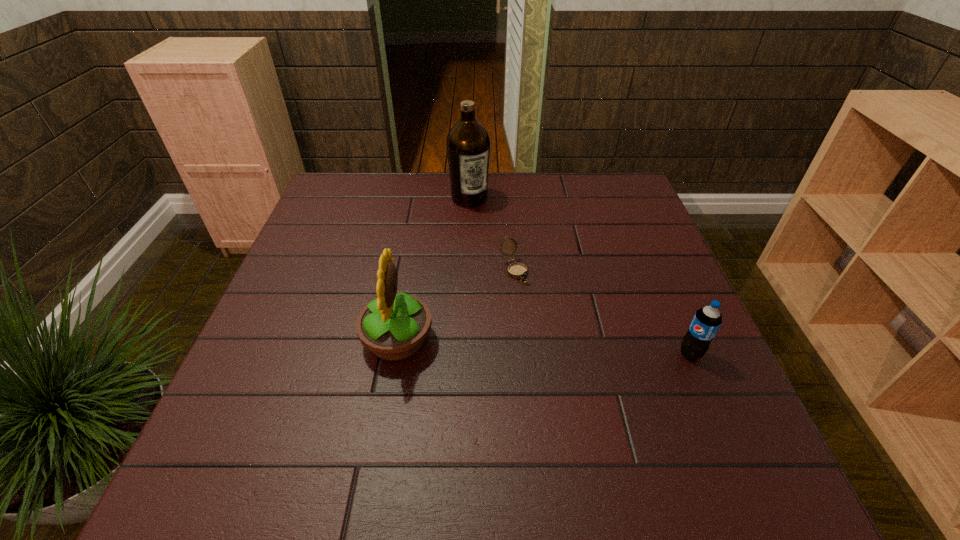
Identify the location of vacant space at the left edge of the desktop. (332, 285).

In the image, there is a desktop. Identify the location of vacant space at the right edge. The height and width of the screenshot is (540, 960). (635, 275).

In the image, there is a desktop. What are the coordinates of `vacant space at the far left corner` in the screenshot? It's located at tap(330, 179).

At what (x,y) coordinates should I click in order to perform the action: click on free point between the second tallest object and the farthest object. Please return your answer as a coordinate pair (x, y). Looking at the image, I should click on (433, 269).

The height and width of the screenshot is (540, 960). What are the coordinates of `vacant space that is in between the shortest object and the soda bottle` in the screenshot? It's located at (602, 312).

Locate an element on the screen. free space between the second object from left to right and the second tallest object is located at coordinates [433, 269].

At what (x,y) coordinates should I click in order to perform the action: click on unoccupied position between the compass and the rightmost object. Please return your answer as a coordinate pair (x, y). The image size is (960, 540). Looking at the image, I should click on (602, 312).

I want to click on free area in between the second farthest object and the rightmost object, so click(602, 312).

Where is `blank region between the olive oil and the rightmost object`? The image size is (960, 540). blank region between the olive oil and the rightmost object is located at coordinates (580, 276).

This screenshot has width=960, height=540. Find the location of `free space between the tallest object and the leftmost object`. free space between the tallest object and the leftmost object is located at coordinates (433, 269).